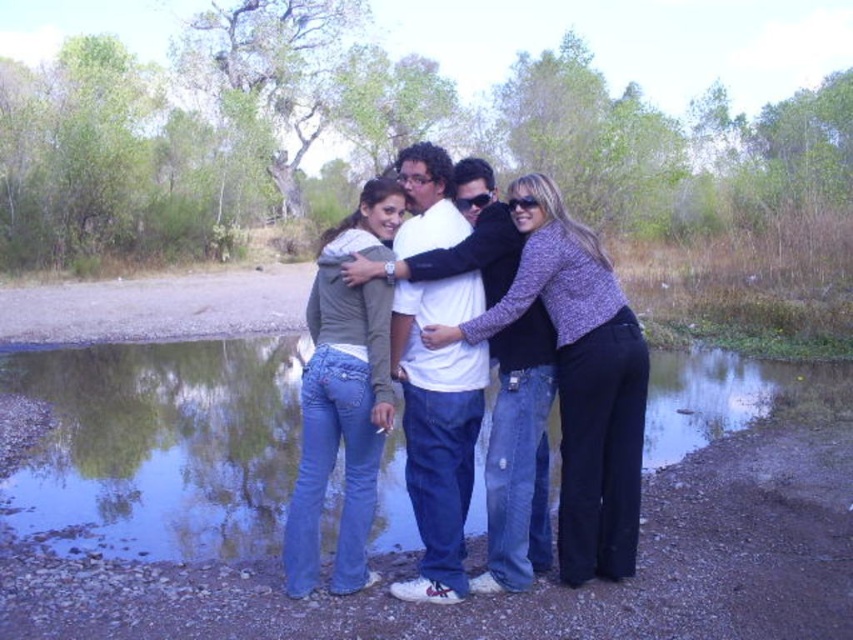
Question: Where is green reflective water at center located in relation to denim jeans at center in the image?

Choices:
 (A) left
 (B) right

Answer: (A)

Question: Which object is farther from the camera taking this photo?

Choices:
 (A) denim jeans at center
 (B) green reflective water at center

Answer: (B)

Question: Does green reflective water at center have a smaller size compared to denim jeans at center?

Choices:
 (A) yes
 (B) no

Answer: (B)

Question: Which point appears closest to the camera in this image?

Choices:
 (A) (640, 420)
 (B) (212, 548)

Answer: (A)

Question: Can you confirm if green reflective water at center is thinner than denim jeans at center?

Choices:
 (A) no
 (B) yes

Answer: (A)